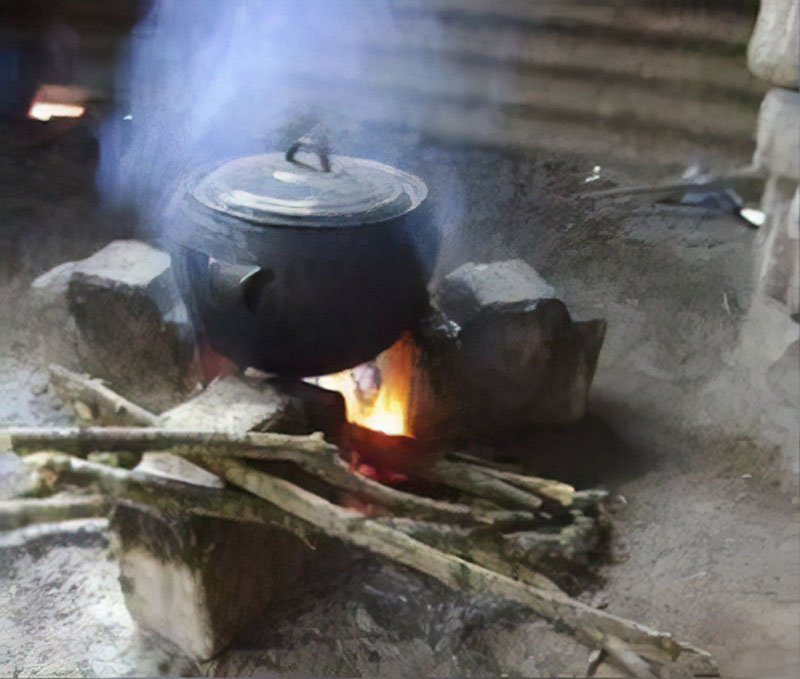
Where is `pot lid handle`? pot lid handle is located at coordinates (312, 142).